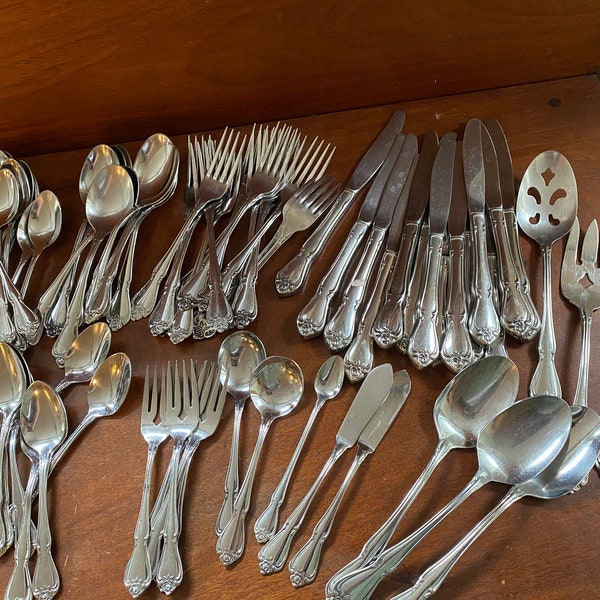
Where is `silver butter knives`? The height and width of the screenshot is (600, 600). silver butter knives is located at coordinates (359, 169), (373, 190), (388, 190), (403, 193), (418, 193), (440, 193), (466, 193), (477, 169), (489, 169), (510, 169).